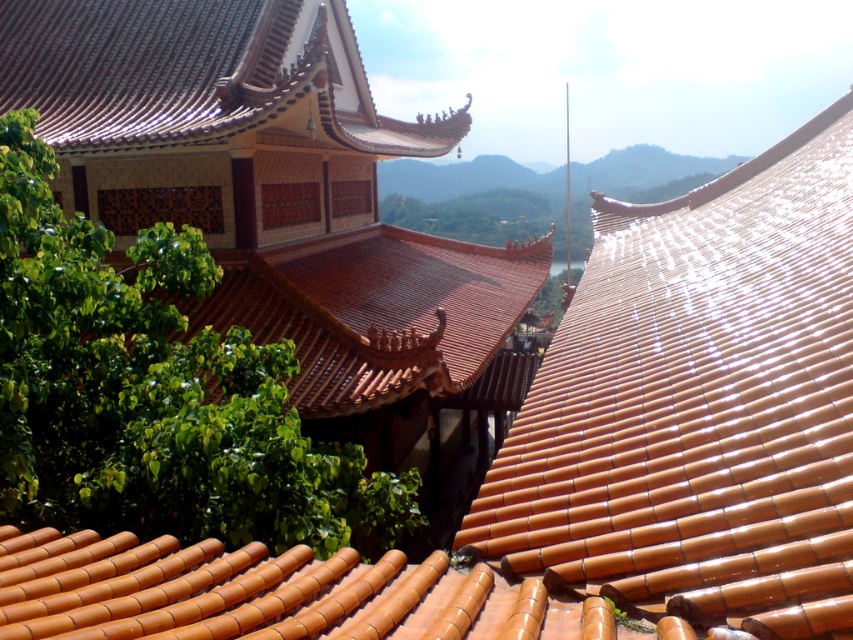
Can you confirm if orange glazed tiles at upper right is positioned below green leafy tree at center?

Actually, orange glazed tiles at upper right is above green leafy tree at center.

Does orange glazed tiles at upper right have a greater height compared to green leafy tree at center?

Correct, orange glazed tiles at upper right is much taller as green leafy tree at center.

What do you see at coordinates (698, 406) in the screenshot?
I see `orange glazed tiles at upper right` at bounding box center [698, 406].

Find the location of a particular element. orange glazed tiles at upper right is located at coordinates (698, 406).

Is green leafy tree at center taller than shiny brown tiles at upper left?

In fact, green leafy tree at center may be shorter than shiny brown tiles at upper left.

In the scene shown: Which is more to the right, green leafy tree at center or shiny brown tiles at upper left?

green leafy tree at center is more to the right.

Image resolution: width=853 pixels, height=640 pixels. Identify the location of green leafy tree at center. (154, 394).

Who is higher up, orange glazed tiles at upper right or shiny brown tiles at upper left?

shiny brown tiles at upper left

From the picture: Which of these two, orange glazed tiles at upper right or shiny brown tiles at upper left, stands shorter?

shiny brown tiles at upper left

Is point (776, 634) positioned behind point (82, 132)?

No, it is in front of (82, 132).

What are the coordinates of `orange glazed tiles at upper right` in the screenshot? It's located at (698, 406).